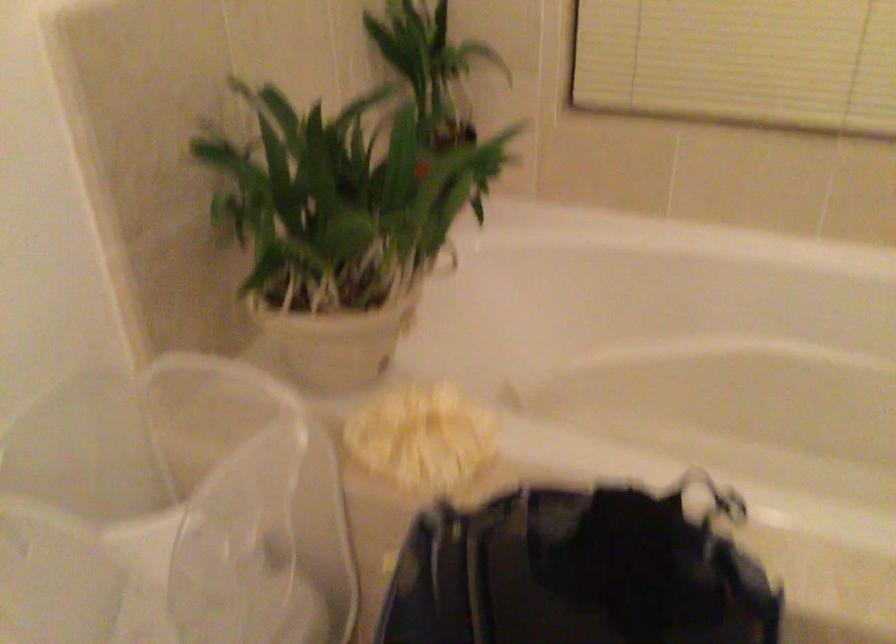
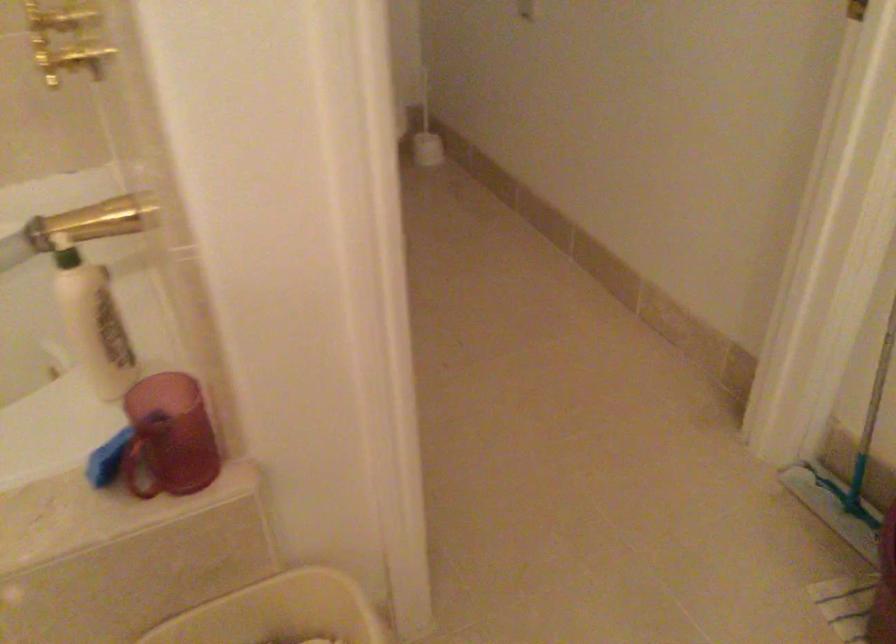
Question: The camera is either moving clockwise (left) or counter-clockwise (right) around the object. The first image is from the beginning of the video and the second image is from the end. Is the camera moving left or right when shooting the video?

Choices:
 (A) Left
 (B) Right

Answer: (A)